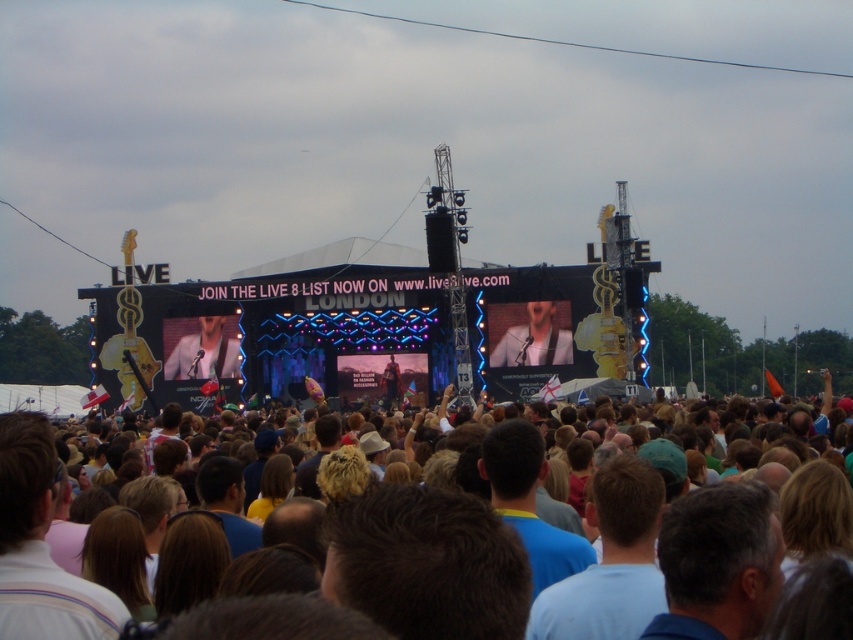
Question: Estimate the real-world distances between objects in this image. Which object is farther from the matte black jacket at center?

Choices:
 (A) matte white shirt at center
 (B) brown hair at center

Answer: (A)

Question: Can you confirm if matte white shirt at center is positioned to the right of matte black jacket at center?

Choices:
 (A) no
 (B) yes

Answer: (B)

Question: Can you confirm if brown hair at center is bigger than matte white shirt at center?

Choices:
 (A) yes
 (B) no

Answer: (A)

Question: Which of the following is the farthest from the observer?

Choices:
 (A) (196, 342)
 (B) (228, 456)

Answer: (A)

Question: Does brown hair at center lie behind matte white shirt at center?

Choices:
 (A) yes
 (B) no

Answer: (B)

Question: Which point is farther from the camera taking this photo?

Choices:
 (A) (514, 588)
 (B) (206, 324)

Answer: (B)